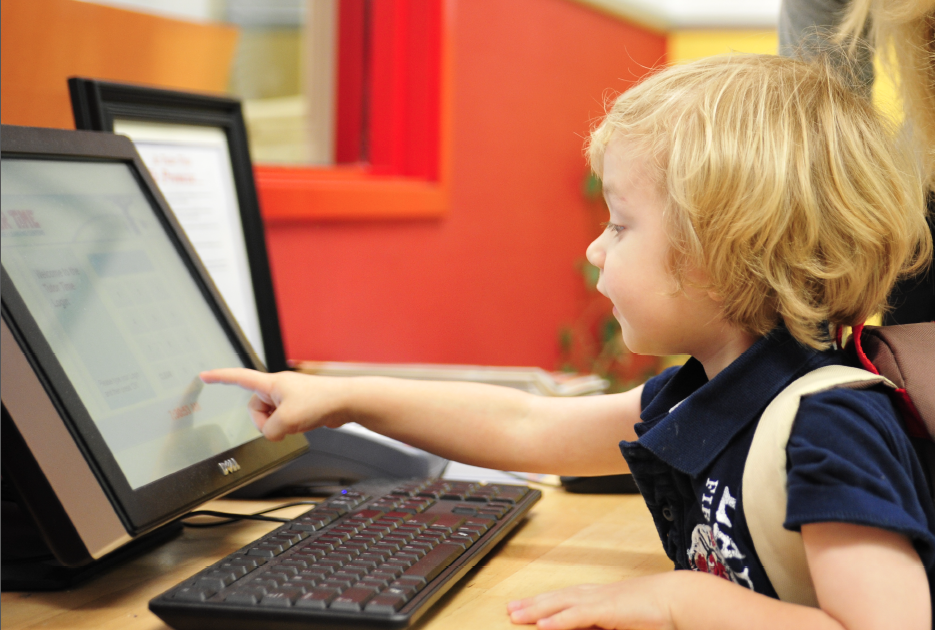
Identify the location of 1 keyboard. Image resolution: width=935 pixels, height=630 pixels. (341, 571).